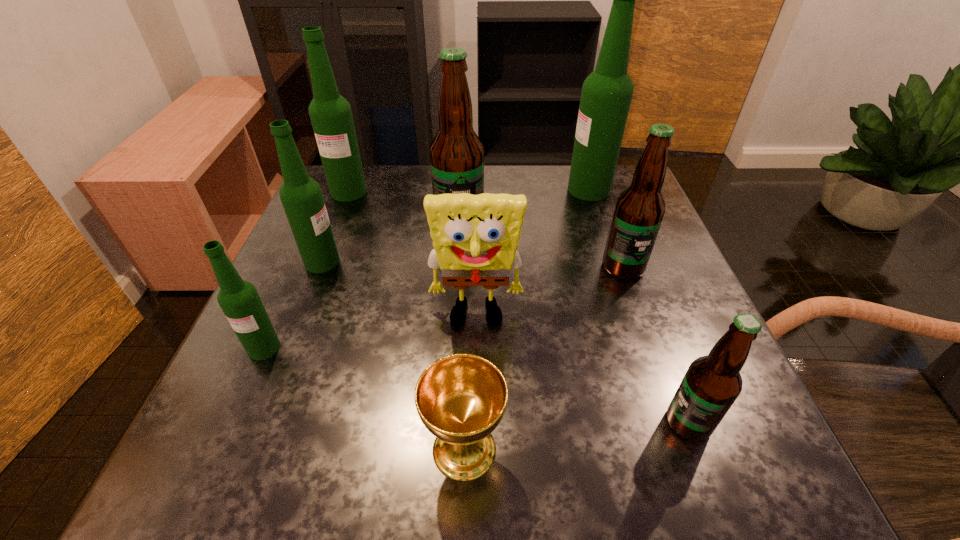
Locate an element on the screen. This screenshot has width=960, height=540. the nearest green beer bottle is located at coordinates (239, 300).

Image resolution: width=960 pixels, height=540 pixels. In order to click on the third nearest object in this screenshot , I will do `click(239, 300)`.

I want to click on gold chalice, so click(x=461, y=398).

Locate an element on the screen. The image size is (960, 540). chalice is located at coordinates (461, 398).

Locate an element on the screen. vacant space located on the label of the tallest object is located at coordinates (462, 190).

Locate an element on the screen. The height and width of the screenshot is (540, 960). free point located 0.390m on the label of the tallest object is located at coordinates (414, 190).

Locate an element on the screen. free point located 0.180m on the label of the tallest object is located at coordinates (496, 190).

What are the coordinates of `free spot located 0.400m on the label of the third smallest green beer bottle` in the screenshot? It's located at (295, 326).

Locate an element on the screen. This screenshot has width=960, height=540. blank space located on the label of the biggest brown beer bottle is located at coordinates (454, 316).

The height and width of the screenshot is (540, 960). Find the location of `vacant region located 0.310m on the label of the third biggest green beer bottle`. vacant region located 0.310m on the label of the third biggest green beer bottle is located at coordinates coord(489,262).